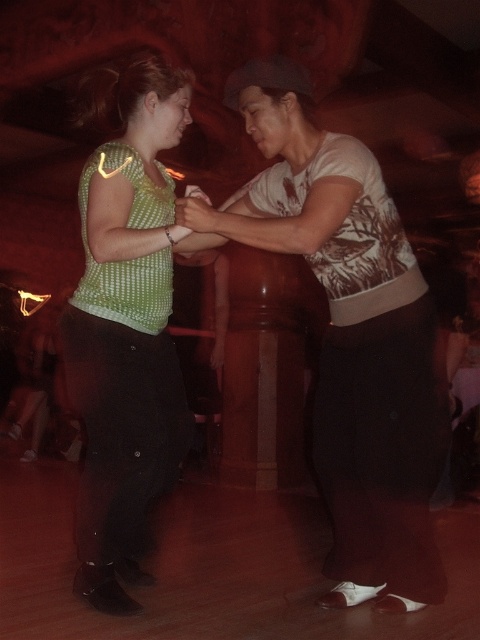
Question: From the image, what is the correct spatial relationship of green dotted shirt at center in relation to green dotted blouse at center?

Choices:
 (A) right
 (B) left

Answer: (A)

Question: Which point is farther from the camera taking this photo?

Choices:
 (A) [x=121, y=451]
 (B) [x=348, y=490]

Answer: (B)

Question: Among these objects, which one is nearest to the camera?

Choices:
 (A) green dotted shirt at center
 (B) green dotted blouse at center

Answer: (A)

Question: In this image, where is green dotted shirt at center located relative to green dotted blouse at center?

Choices:
 (A) below
 (B) above

Answer: (A)

Question: Does green dotted shirt at center appear on the left side of green dotted blouse at center?

Choices:
 (A) no
 (B) yes

Answer: (A)